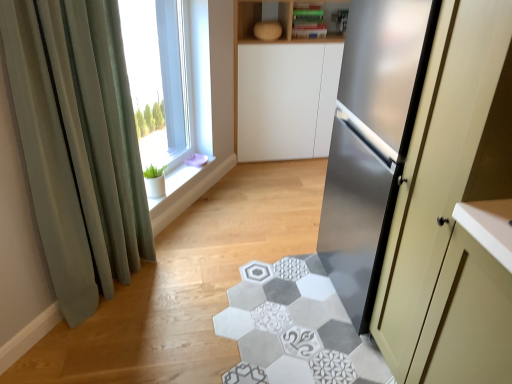
The width and height of the screenshot is (512, 384). I want to click on vacant area that lies between green fabric curtain at left and satin silver refrigerator at right, so click(x=238, y=305).